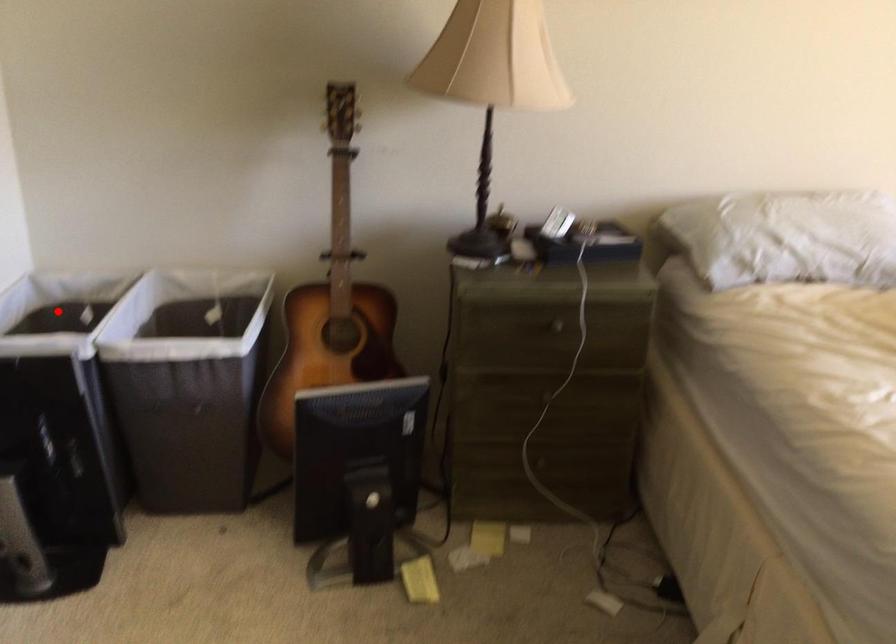
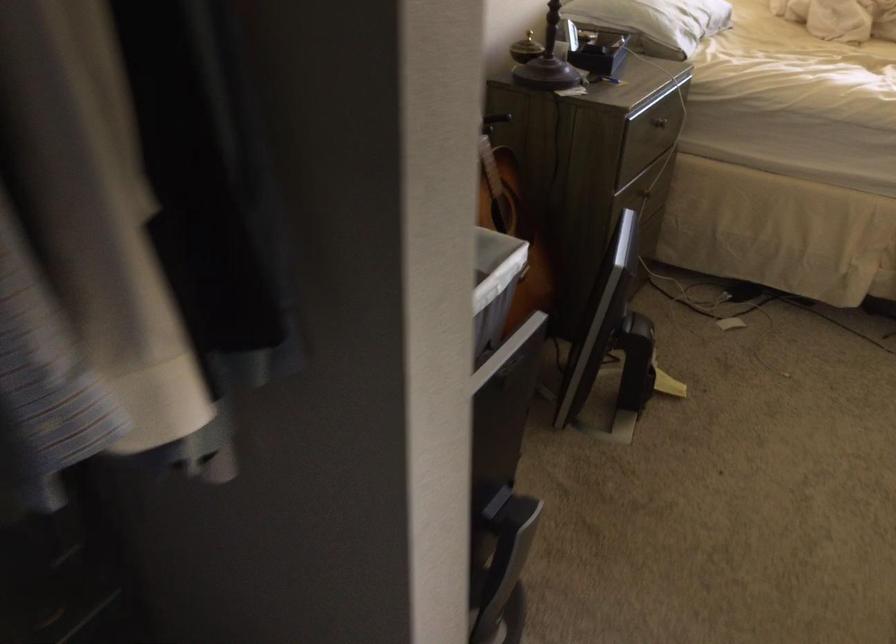
Question: I am providing you with two images of the same scene from different viewpoints. A red point is marked on the first image. At the location where the point appears in image 1, is it still visible in image 2?

Choices:
 (A) Yes
 (B) No

Answer: (B)